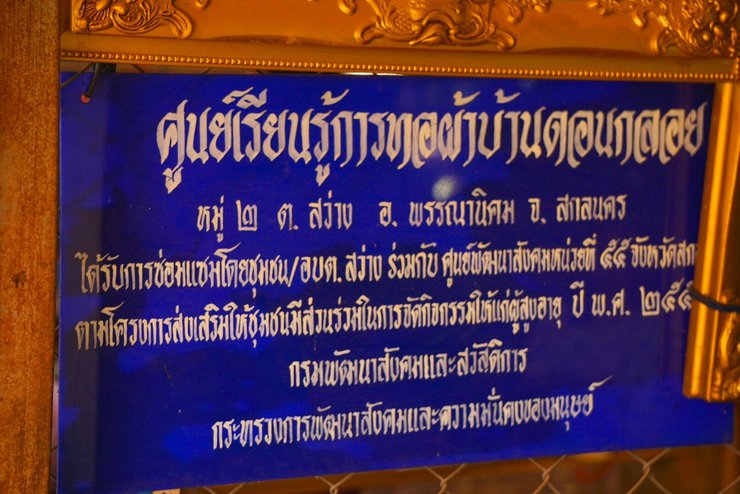
Locate an element on the screen. The height and width of the screenshot is (494, 740). canvas is located at coordinates (568, 411).